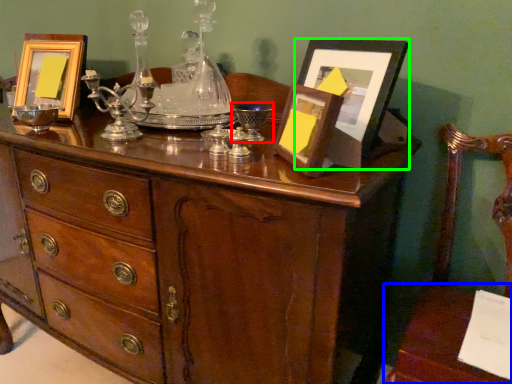
Question: Which object is positioned farthest from wine glass (highlighted by a red box)? Select from table (highlighted by a blue box) and picture frame (highlighted by a green box).

Choices:
 (A) table
 (B) picture frame

Answer: (A)